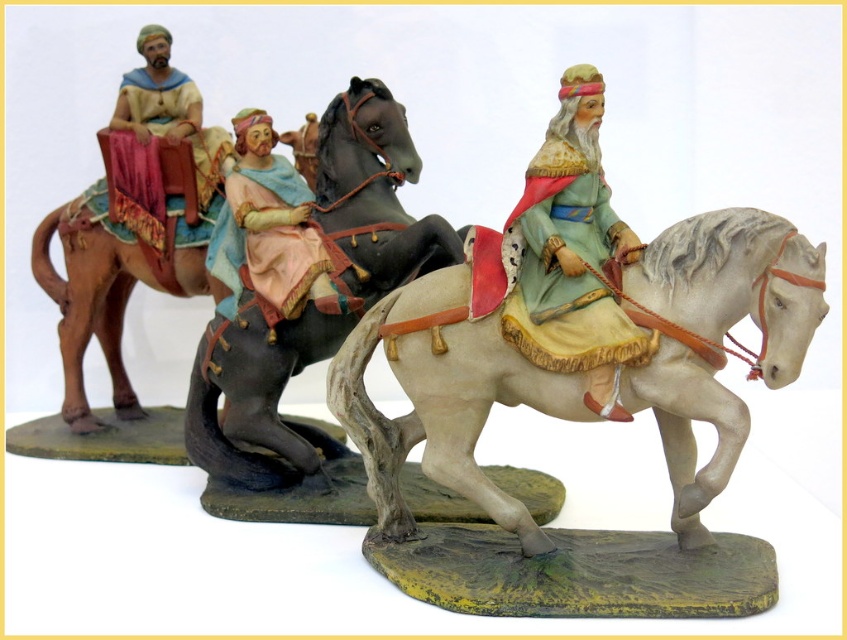
Between shiny black horse at center and porcelain figure at center, which one has more height?

shiny black horse at center

Who is positioned more to the right, shiny black horse at center or porcelain figure at center?

porcelain figure at center

The width and height of the screenshot is (847, 640). Identify the location of shiny black horse at center. (313, 300).

Which is in front, point (617, 246) or point (231, 168)?

Point (617, 246)

Can you confirm if porcelain figure at center is shorter than matte plastic figure at center?

No.

This screenshot has width=847, height=640. Find the location of `porcelain figure at center`. porcelain figure at center is located at coordinates (573, 218).

The image size is (847, 640). Identify the location of porcelain figure at center. (573, 218).

Which is behind, point (527, 380) or point (259, 417)?

Point (259, 417)

Is white matte horse at center wider than shiny black horse at center?

Yes, white matte horse at center is wider than shiny black horse at center.

Locate an element on the screen. This screenshot has width=847, height=640. white matte horse at center is located at coordinates [x=441, y=401].